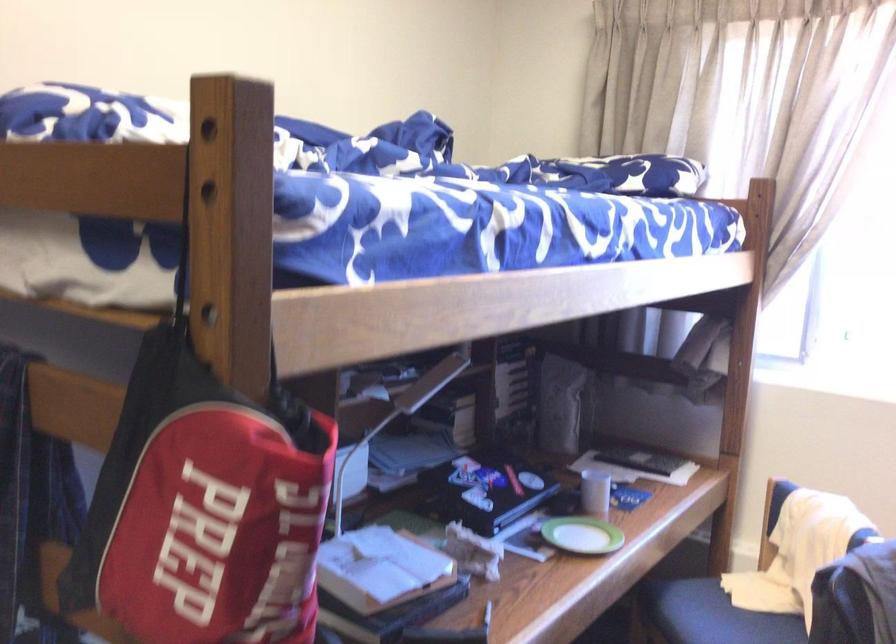
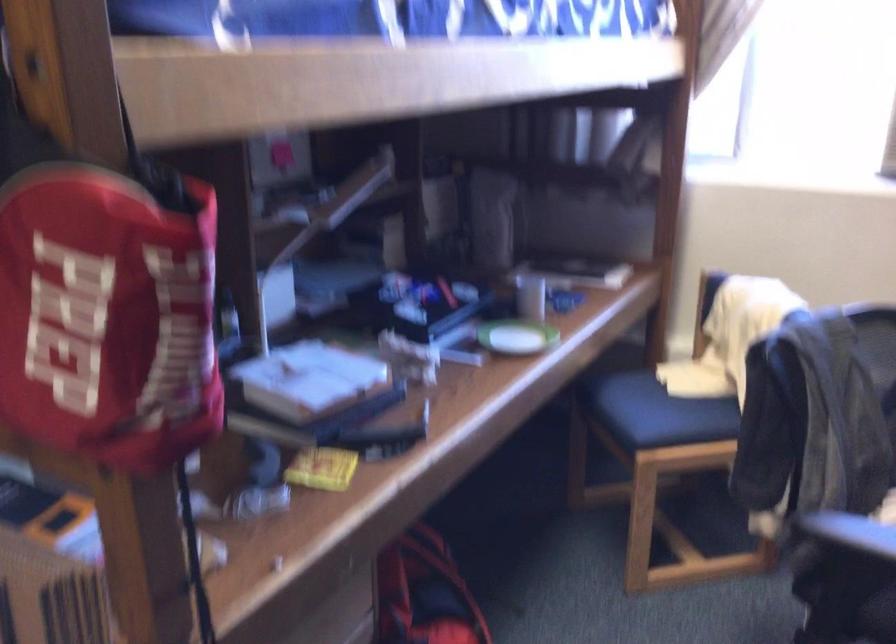
Question: In a continuous first-person perspective shot, in which direction is the camera moving?

Choices:
 (A) Left
 (B) Right
 (C) Forward
 (D) Backward

Answer: (C)